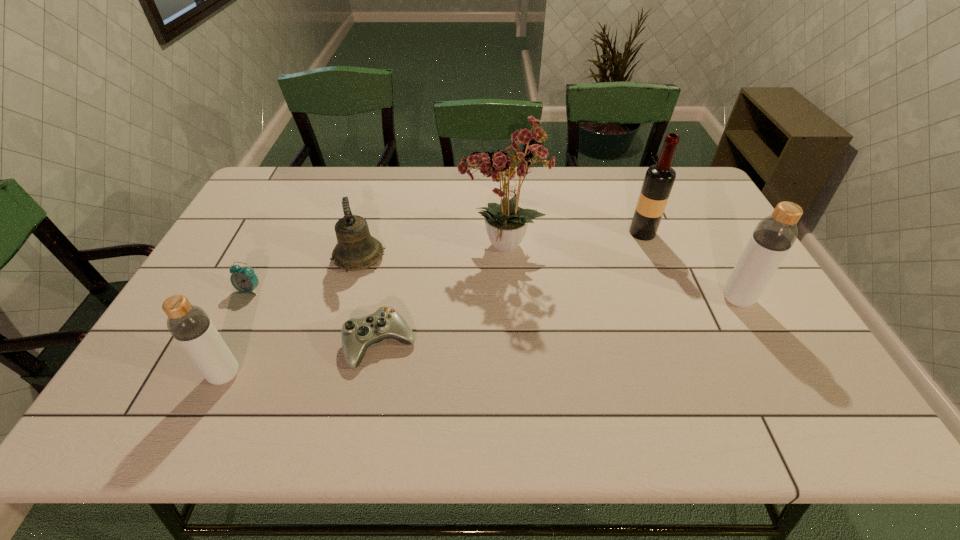
Identify which object is the sixth closest to the taller bottle. Please provide its 2D coordinates. Your answer should be formatted as a tuple, i.e. [(x, y)], where the tuple contains the x and y coordinates of a point satisfying the conditions above.

[(244, 280)]

Select which object is the closest to the shorter bottle. Please provide its 2D coordinates. Your answer should be formatted as a tuple, i.e. [(x, y)], where the tuple contains the x and y coordinates of a point satisfying the conditions above.

[(244, 280)]

You are a GUI agent. You are given a task and a screenshot of the screen. Output one action in this format:
    pyautogui.click(x=<x>, y=<y>)
    Task: Click on the vacant area in the image that satisfies the following two spatial constraints: 1. on the back side of the nearer bottle; 2. on the left side of the control
    
    Given the screenshot: What is the action you would take?
    pyautogui.click(x=240, y=344)

Locate an element on the screen. Image resolution: width=960 pixels, height=540 pixels. free region that satisfies the following two spatial constraints: 1. on the front-facing side of the third object from right to left; 2. on the front side of the shortest object is located at coordinates (507, 344).

Locate an element on the screen. Image resolution: width=960 pixels, height=540 pixels. vacant position in the image that satisfies the following two spatial constraints: 1. on the front side of the second object from right to left; 2. on the front-facing side of the third object from right to left is located at coordinates (648, 247).

The width and height of the screenshot is (960, 540). I want to click on free space that satisfies the following two spatial constraints: 1. on the face of the alarm clock; 2. on the left side of the left bottle, so click(207, 375).